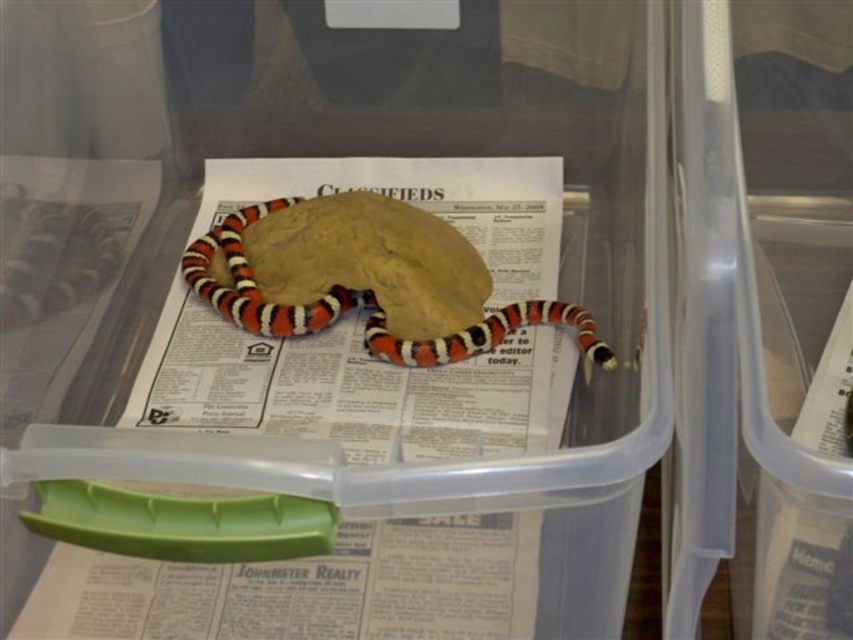
Who is more distant from viewer, (270, 577) or (238, 268)?

The point (238, 268) is more distant.

Locate an element on the screen. white printed newspaper at center is located at coordinates (306, 588).

Is point (550, 220) positioned behind point (491, 348)?

Yes, it is behind point (491, 348).

This screenshot has height=640, width=853. I want to click on white printed newspaper at center, so click(x=306, y=588).

Between point (258, 324) and point (80, 268), which one is positioned behind?

Positioned behind is point (80, 268).

Between orange and white striped snake at center and smooth glossy snake at left, which one appears on the right side from the viewer's perspective?

orange and white striped snake at center

The height and width of the screenshot is (640, 853). What do you see at coordinates (361, 307) in the screenshot?
I see `orange and white striped snake at center` at bounding box center [361, 307].

You are a GUI agent. You are given a task and a screenshot of the screen. Output one action in this format:
    pyautogui.click(x=<x>, y=<y>)
    Task: Click on the orange and white striped snake at center
    The image size is (853, 640).
    Given the screenshot: What is the action you would take?
    pyautogui.click(x=361, y=307)

Where is `white printed newspaper at center`? The image size is (853, 640). white printed newspaper at center is located at coordinates (306, 588).

Can you confirm if white printed newspaper at center is positioned to the left of smooth glossy snake at left?

No, white printed newspaper at center is not to the left of smooth glossy snake at left.

This screenshot has width=853, height=640. I want to click on white printed newspaper at center, so click(306, 588).